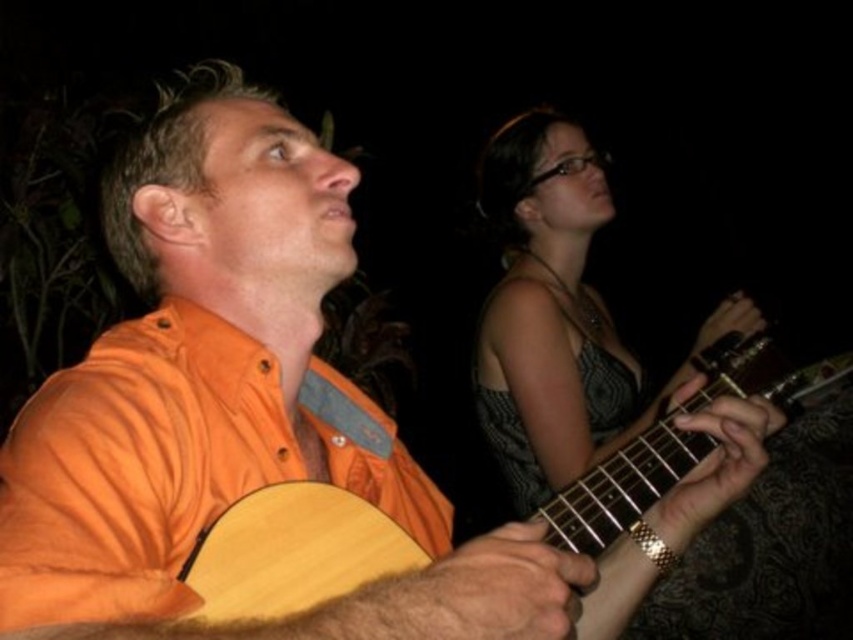
Can you confirm if matte gray dress at upper right is taller than wooden acoustic guitar at center?

Yes, matte gray dress at upper right is taller than wooden acoustic guitar at center.

This screenshot has width=853, height=640. What are the coordinates of `matte gray dress at upper right` in the screenshot? It's located at pos(560,314).